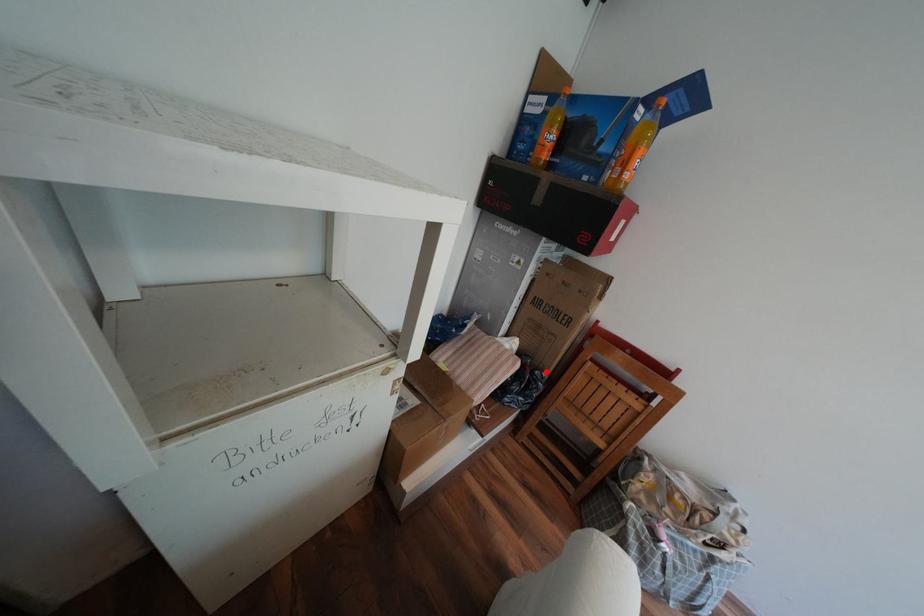
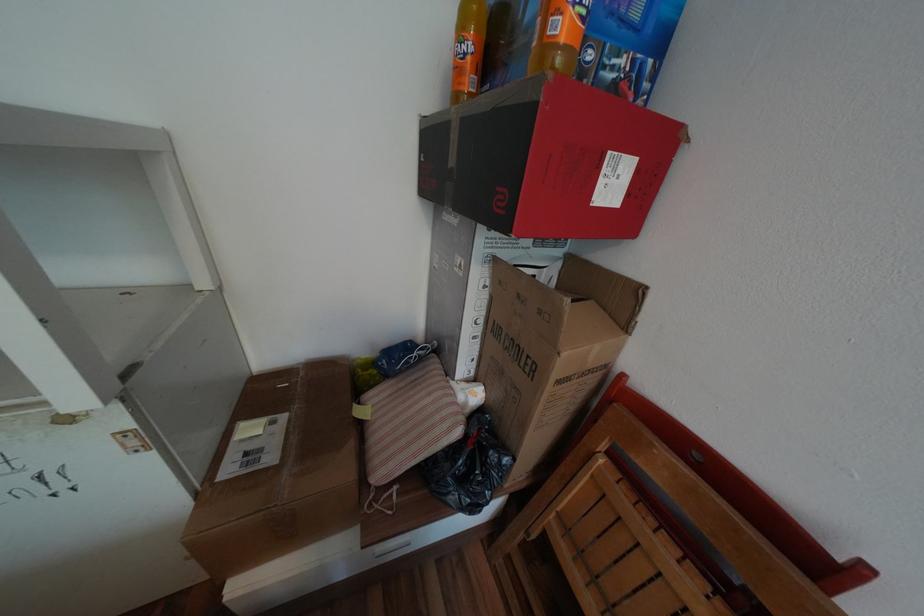
Locate, in the second image, the point that corresponds to the highlighted location in the first image.

(500, 453)